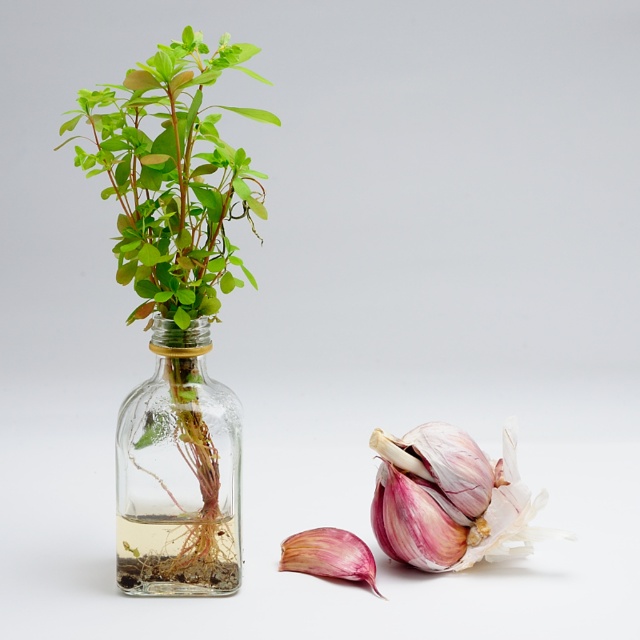
Does transparent glass vase at left have a larger size compared to pinkish-purple papery onion at lower right?

Yes.

Image resolution: width=640 pixels, height=640 pixels. What do you see at coordinates (179, 474) in the screenshot?
I see `transparent glass vase at left` at bounding box center [179, 474].

Where is `transparent glass vase at left`? transparent glass vase at left is located at coordinates (179, 474).

Who is higher up, green matte plant at center or transparent glass vase at left?

green matte plant at center

Does point (134, 545) come closer to viewer compared to point (195, 586)?

No, it is behind (195, 586).

The width and height of the screenshot is (640, 640). I want to click on green matte plant at center, so click(173, 310).

Is the position of transparent glass vase at left less distant than that of pink matte garlic at lower right?

Yes, it is in front of pink matte garlic at lower right.

Consider the image. Which is more to the right, transparent glass vase at left or pink matte garlic at lower right?

pink matte garlic at lower right

Does point (125, 396) come farther from viewer compared to point (356, 548)?

That is False.

Locate an element on the screen. transparent glass vase at left is located at coordinates (179, 474).